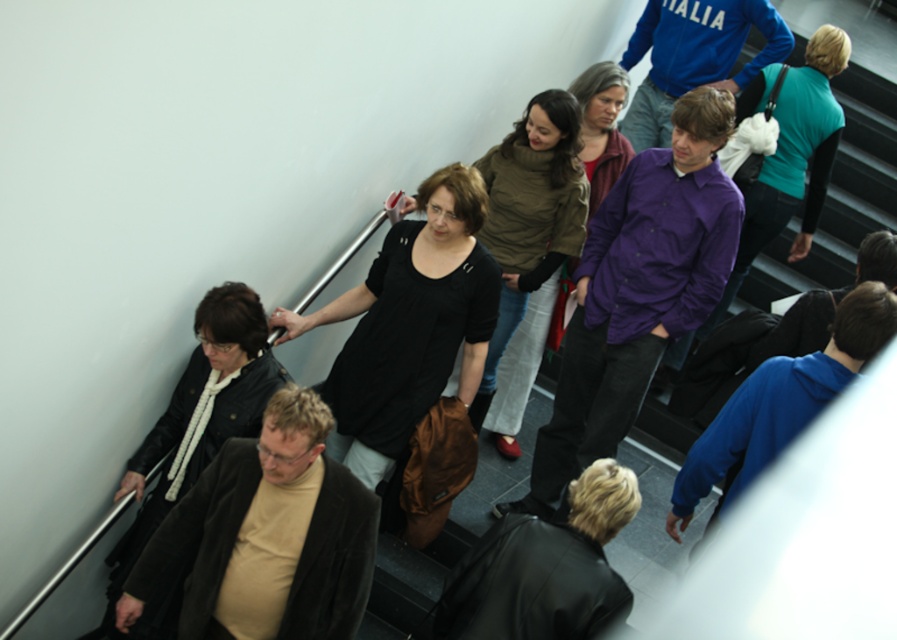
Question: Which point is closer to the camera?

Choices:
 (A) black matte dress at center
 (B) black leather jacket at lower left

Answer: (B)

Question: Considering the relative positions of black leather jacket at lower left and black matte dress at center in the image provided, where is black leather jacket at lower left located with respect to black matte dress at center?

Choices:
 (A) above
 (B) below

Answer: (B)

Question: Which point is farther to the camera?

Choices:
 (A) black leather jacket at lower left
 (B) black matte dress at center

Answer: (B)

Question: Can you confirm if black leather jacket at lower left is thinner than black matte dress at center?

Choices:
 (A) yes
 (B) no

Answer: (B)

Question: Which of the following is the closest to the observer?

Choices:
 (A) black leather jacket at lower left
 (B) black matte dress at center

Answer: (A)

Question: Does black leather jacket at lower left have a greater width compared to black matte dress at center?

Choices:
 (A) yes
 (B) no

Answer: (A)